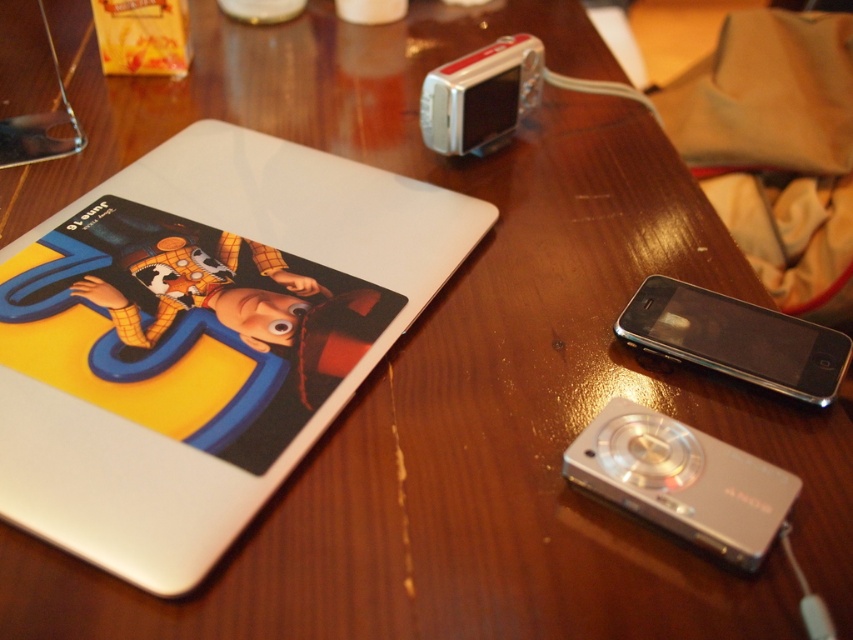
Question: Does black glossy smartphone at right appear on the left side of silver metallic camera at upper center?

Choices:
 (A) no
 (B) yes

Answer: (A)

Question: Among these objects, which one is nearest to the camera?

Choices:
 (A) black glossy smartphone at right
 (B) silver metallic camera at upper center
 (C) silver metallic camera at center
 (D) glossy white laptop at upper left

Answer: (D)

Question: Does glossy white laptop at upper left appear under silver metallic camera at center?

Choices:
 (A) no
 (B) yes

Answer: (A)

Question: Which object is closer to the camera taking this photo?

Choices:
 (A) silver metallic camera at center
 (B) silver metallic camera at upper center

Answer: (A)

Question: Which object is farther from the camera taking this photo?

Choices:
 (A) glossy white laptop at upper left
 (B) silver metallic camera at center
 (C) black glossy smartphone at right
 (D) silver metallic camera at upper center

Answer: (D)

Question: From the image, what is the correct spatial relationship of glossy white laptop at upper left in relation to black glossy smartphone at right?

Choices:
 (A) below
 (B) above

Answer: (B)